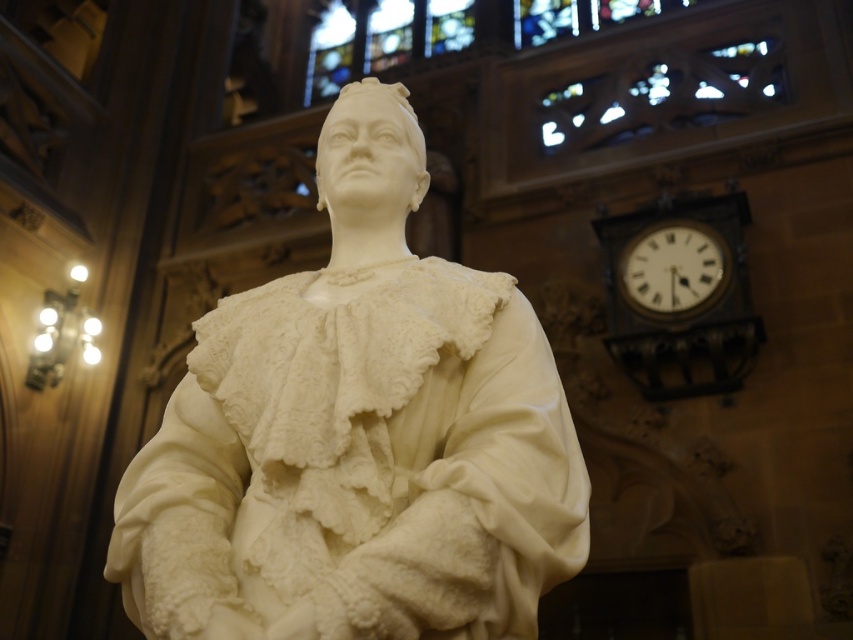
Is point (637, 344) positioned in front of point (662, 276)?

Yes, point (637, 344) is in front of point (662, 276).

This screenshot has height=640, width=853. I want to click on dark brown wooden clock at upper right, so click(680, 296).

Can you confirm if white marble statue at center is positioned to the right of dark brown wooden clock at upper right?

No, white marble statue at center is not to the right of dark brown wooden clock at upper right.

From the picture: Is the position of white marble statue at center less distant than that of dark brown wooden clock at upper right?

Yes.

Does point (107, 573) come closer to viewer compared to point (672, 394)?

Yes.

You are a GUI agent. You are given a task and a screenshot of the screen. Output one action in this format:
    pyautogui.click(x=<x>, y=<y>)
    Task: Click on the white marble statue at center
    This screenshot has height=640, width=853.
    Given the screenshot: What is the action you would take?
    pyautogui.click(x=357, y=435)

Between white marble statue at center and white wooden clock at upper right, which one appears on the left side from the viewer's perspective?

white marble statue at center is more to the left.

Can you confirm if white marble statue at center is positioned above white wooden clock at upper right?

Actually, white marble statue at center is below white wooden clock at upper right.

I want to click on white marble statue at center, so click(x=357, y=435).

Find the location of `white marble statue at center`. white marble statue at center is located at coordinates (357, 435).